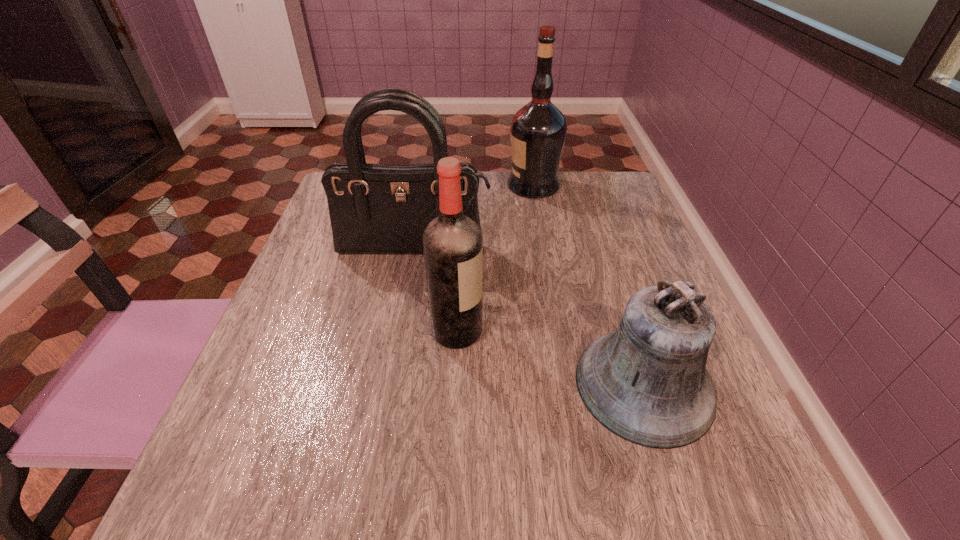
What are the coordinates of `vacant space that satisfies the following two spatial constraints: 1. with an open clasp on the front of the bell; 2. on the right side of the handbag` in the screenshot? It's located at click(x=390, y=384).

The image size is (960, 540). In order to click on vacant area that satisfies the following two spatial constraints: 1. on the back side of the shortest object; 2. on the surface of the right liquor in this screenshot , I will do `click(580, 186)`.

Identify the location of vacant region that satisfies the following two spatial constraints: 1. on the front-facing side of the left liquor; 2. on the right side of the shortest object. (454, 384).

You are a GUI agent. You are given a task and a screenshot of the screen. Output one action in this format:
    pyautogui.click(x=<x>, y=<y>)
    Task: Click on the free space that satisfies the following two spatial constraints: 1. on the surface of the bell; 2. on the right side of the farthest object
    The height and width of the screenshot is (540, 960).
    Given the screenshot: What is the action you would take?
    pyautogui.click(x=568, y=384)

This screenshot has width=960, height=540. What are the coordinates of `vacant region that satisfies the following two spatial constraints: 1. on the front-facing side of the bell; 2. on the left side of the left liquor` in the screenshot? It's located at (454, 384).